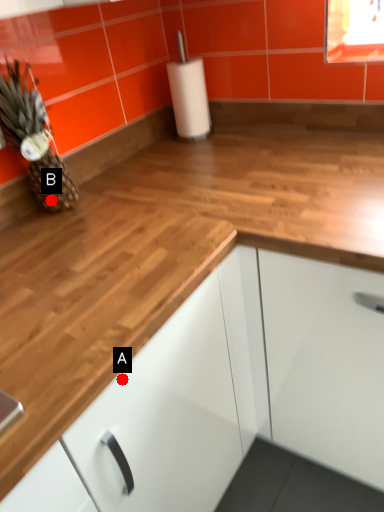
Question: Two points are circled on the image, labeled by A and B beside each circle. Which point is closer to the camera?

Choices:
 (A) A is closer
 (B) B is closer

Answer: (A)